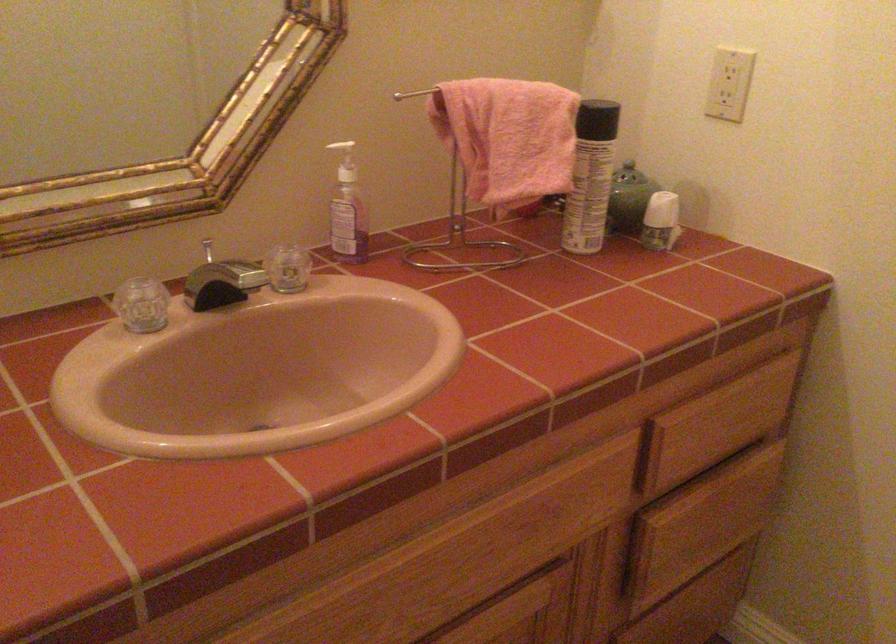
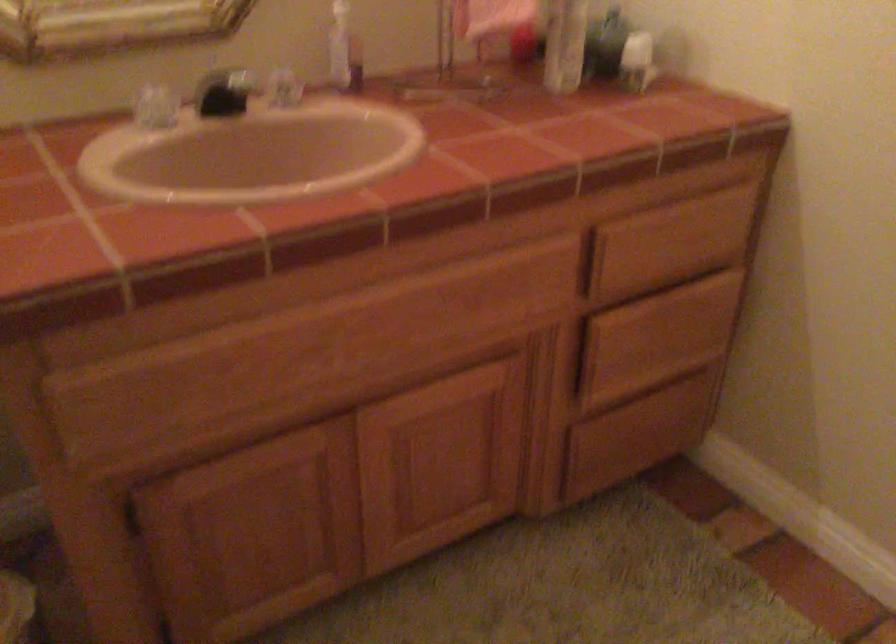
Question: The first image is from the beginning of the video and the second image is from the end. How did the camera likely rotate when shooting the video?

Choices:
 (A) Left
 (B) Right
 (C) Up
 (D) Down

Answer: (D)